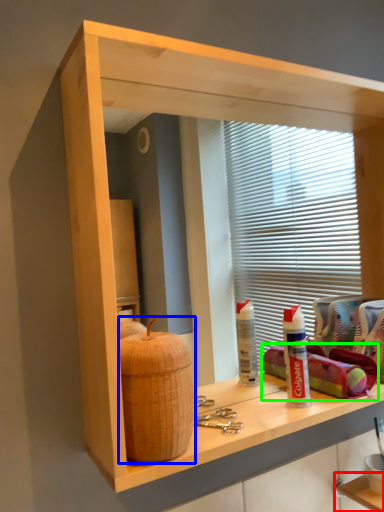
Question: Which object is the closest to the shelf (highlighted by a red box)? Choose among these: basket (highlighted by a blue box) or material (highlighted by a green box).

Choices:
 (A) basket
 (B) material

Answer: (B)